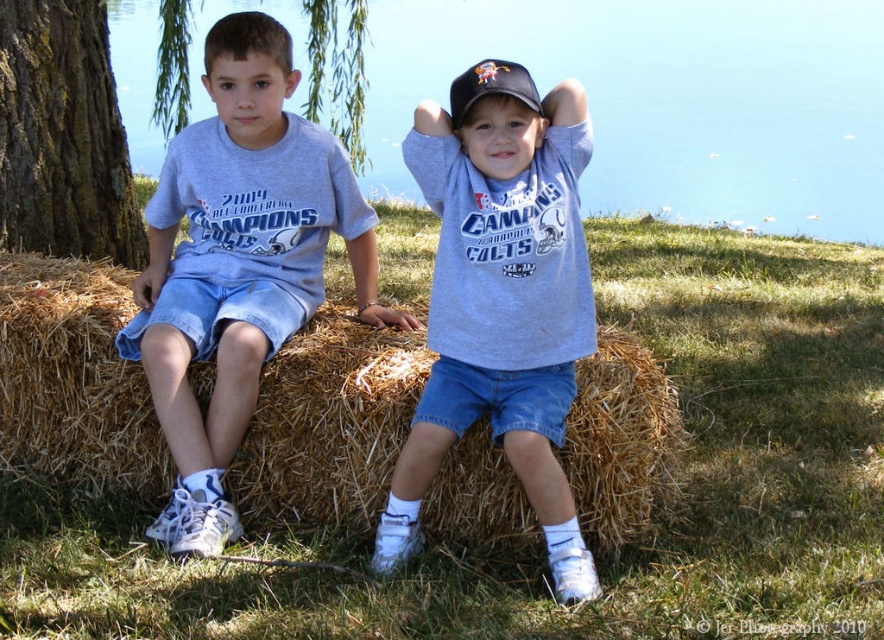
Is blue water at upper center to the left of matte gray t-shirt at center from the viewer's perspective?

Indeed, blue water at upper center is positioned on the left side of matte gray t-shirt at center.

Does point (463, 28) come behind point (494, 410)?

Yes, point (463, 28) is behind point (494, 410).

Who is more forward, (860, 179) or (406, 506)?

Point (406, 506) is more forward.

Where is `blue water at upper center`? Image resolution: width=884 pixels, height=640 pixels. blue water at upper center is located at coordinates (667, 100).

Which of these two, brown straw bale at center or gray cotton t-shirt at left, stands shorter?

brown straw bale at center

Can you confirm if brown straw bale at center is bigger than gray cotton t-shirt at left?

Actually, brown straw bale at center might be smaller than gray cotton t-shirt at left.

Does point (382, 340) lie in front of point (277, 24)?

No, it is not.

Locate an element on the screen. The image size is (884, 640). brown straw bale at center is located at coordinates (74, 380).

Which of these two, gray cotton t-shirt at left or brown rough bark tree at left, stands taller?

gray cotton t-shirt at left

At what (x,y) coordinates should I click in order to perform the action: click on gray cotton t-shirt at left. Please return your answer as a coordinate pair (x, y). The width and height of the screenshot is (884, 640). Looking at the image, I should click on (238, 262).

Locate an element on the screen. This screenshot has height=640, width=884. gray cotton t-shirt at left is located at coordinates (238, 262).